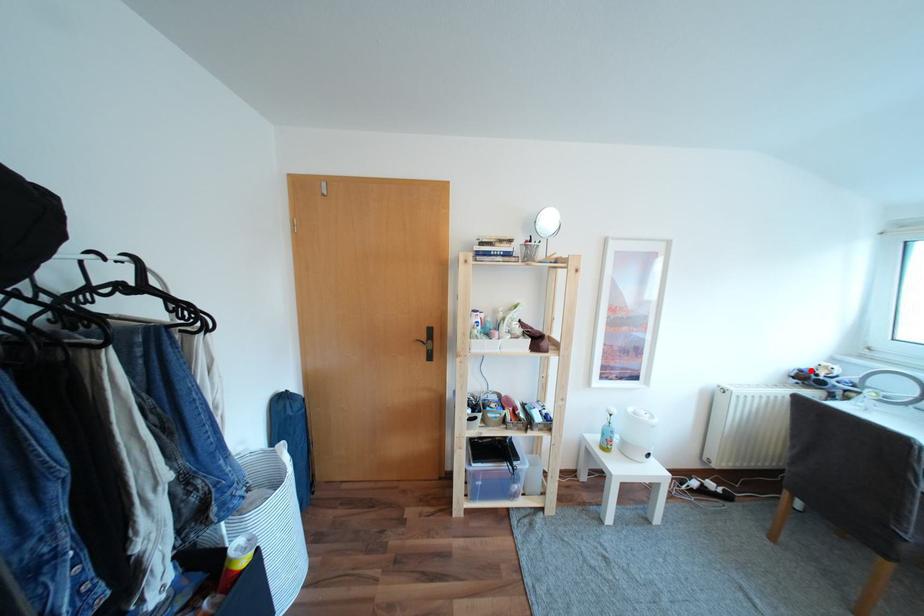
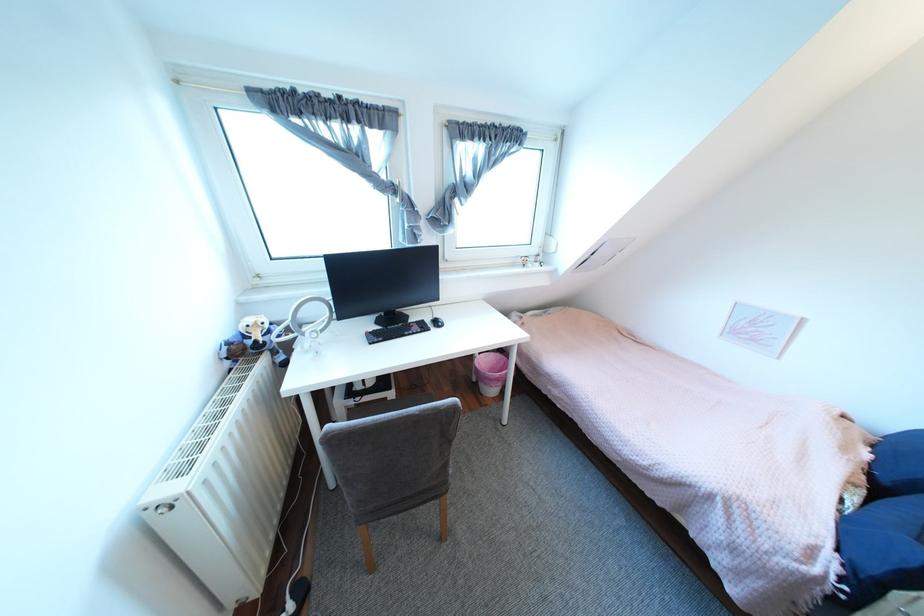
Where in the second image is the point corresponding to the highlighted location from the first image?

(239, 342)